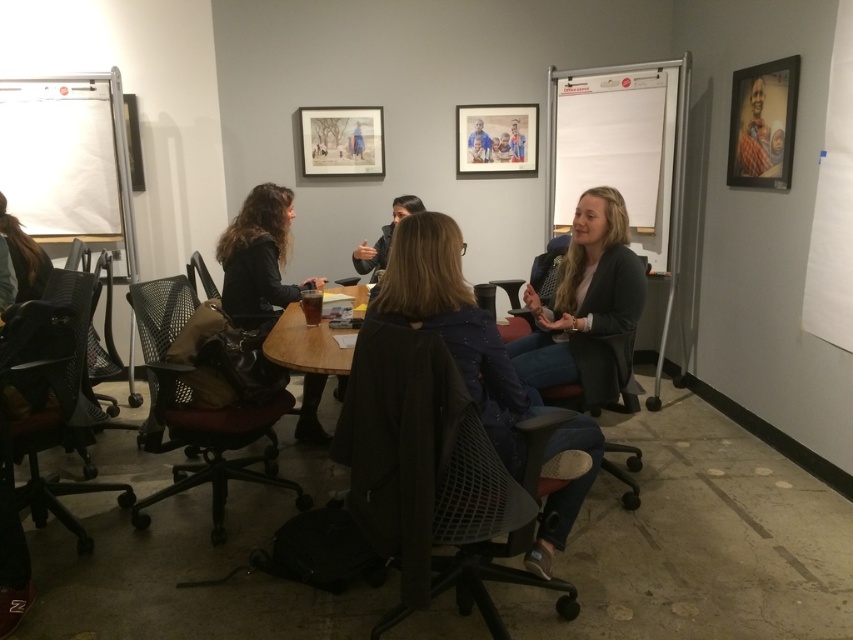
Question: Which point appears farthest from the camera in this image?

Choices:
 (A) (368, 385)
 (B) (209, 275)
 (C) (234, 406)
 (D) (527, 320)

Answer: (B)

Question: Which of the following is the farthest from the observer?

Choices:
 (A) black mesh chair at left
 (B) matte black chair at center
 (C) black mesh office chair at center
 (D) black mesh office chair at lower left

Answer: (B)

Question: Which point is closer to the camera?

Choices:
 (A) mesh fabric office chair at center
 (B) matte black chair at center
 (C) matte black blazer at center

Answer: (A)

Question: Can you confirm if mesh fabric office chair at center is bigger than black mesh office chair at lower left?

Choices:
 (A) no
 (B) yes

Answer: (B)

Question: Can you confirm if black mesh chair at left is thinner than matte black jacket at left?

Choices:
 (A) no
 (B) yes

Answer: (A)

Question: In this image, where is mesh fabric office chair at center located relative to black mesh office chair at center?

Choices:
 (A) above
 (B) below

Answer: (B)